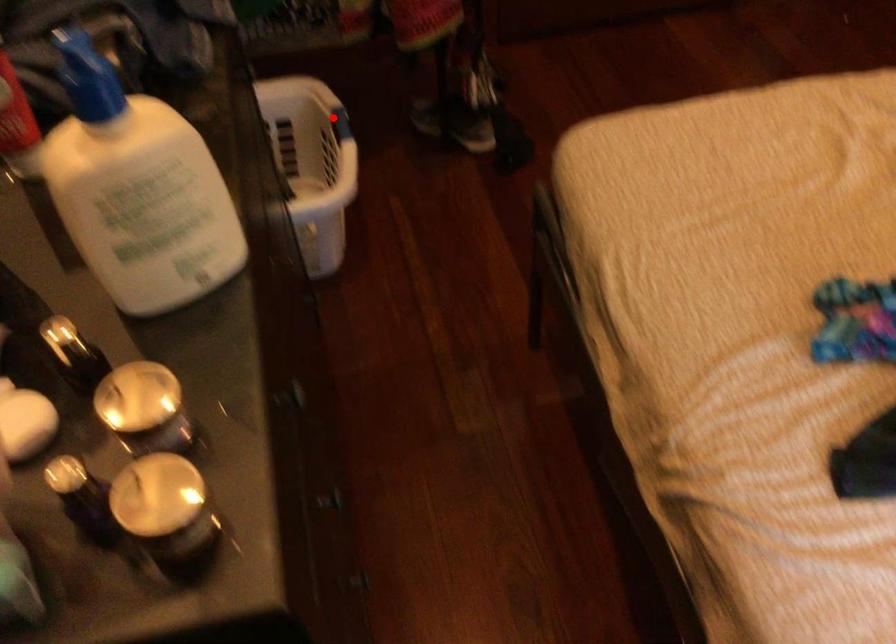
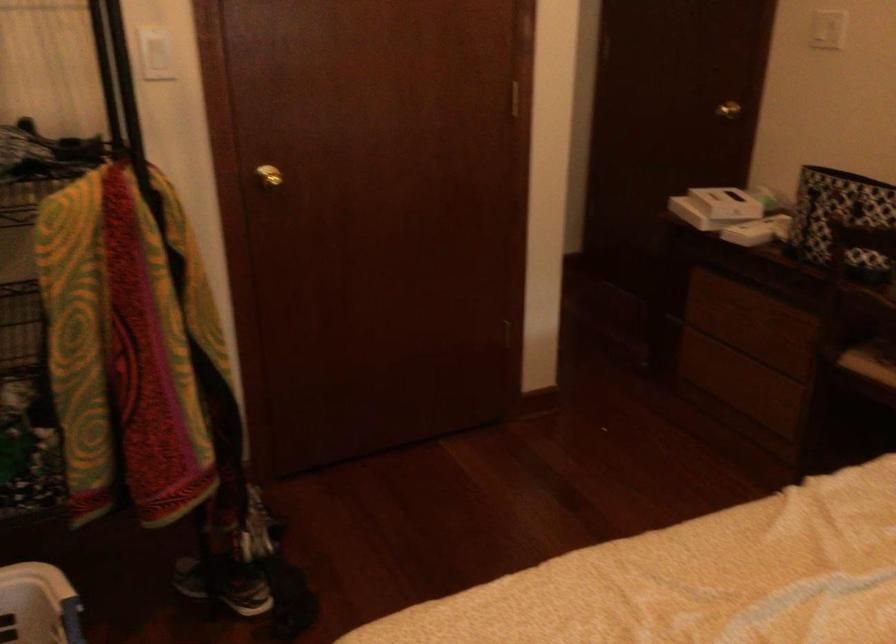
Question: I am providing you with two images of the same scene from different viewpoints. In image1, a red point is highlighted. Considering the same 3D point in image2, which of the following is correct?

Choices:
 (A) It is closer
 (B) It is farther

Answer: (A)